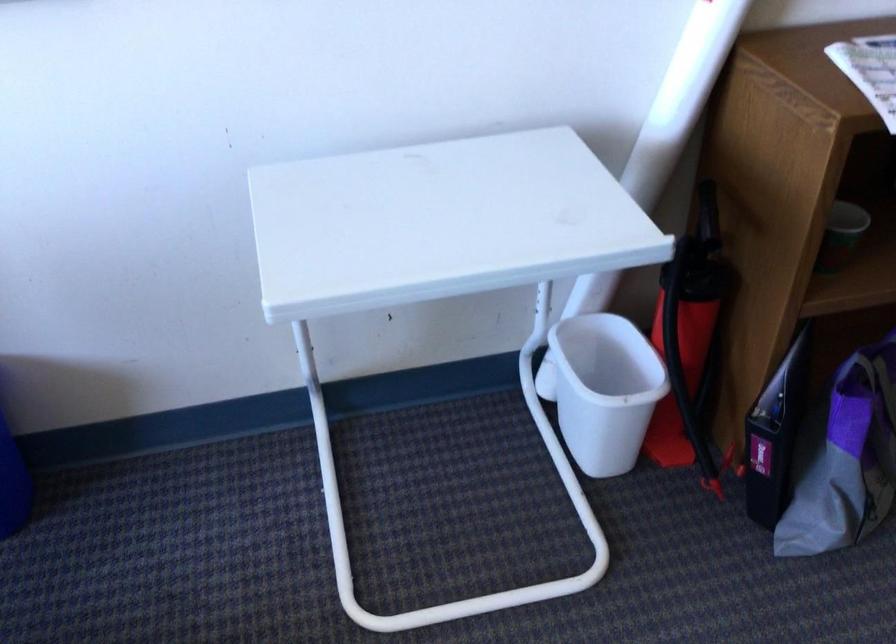
Question: The images are taken continuously from a first-person perspective. In which direction is your viewpoint rotating?

Choices:
 (A) Left
 (B) Right
 (C) Up
 (D) Down

Answer: (B)